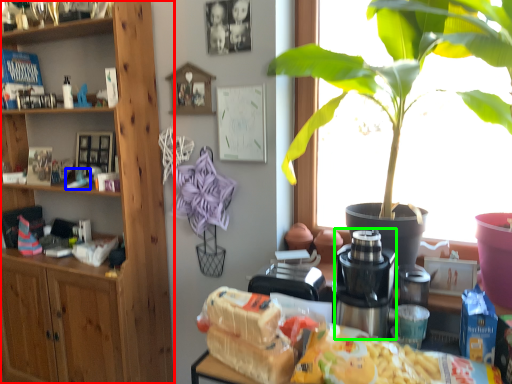
Question: Estimate the real-world distances between objects in this image. Which object is closer to cabinetry (highlighted by a red box), toy (highlighted by a blue box) or coffee machine (highlighted by a green box)?

Choices:
 (A) toy
 (B) coffee machine

Answer: (A)